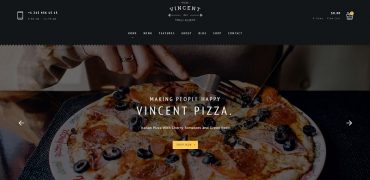
The height and width of the screenshot is (180, 370). In order to click on table in this screenshot , I will do `click(357, 162)`.